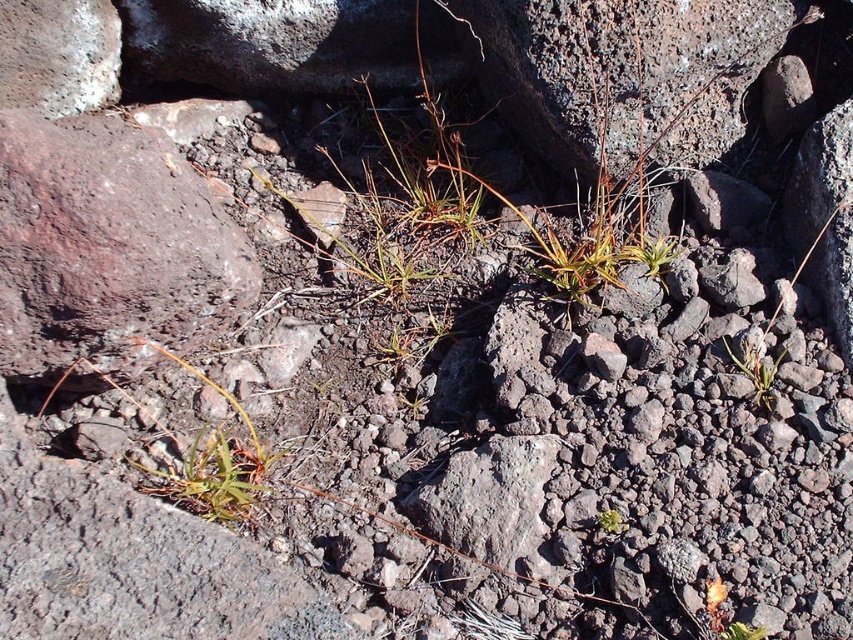
Is green grass at center thinner than green leafy plant at center?

In fact, green grass at center might be wider than green leafy plant at center.

Is point (761, 358) behind point (598, 515)?

Yes.

Is point (757, 403) closer to camera compared to point (613, 520)?

No, it is behind (613, 520).

Locate an element on the screen. Image resolution: width=853 pixels, height=640 pixels. green grass at center is located at coordinates (756, 372).